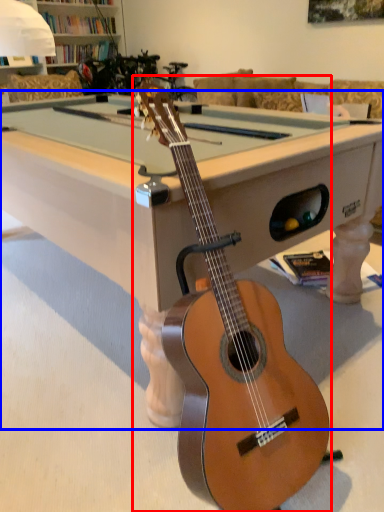
Question: Which of the following is the farthest to the observer, guitar (highlighted by a red box) or billiard table (highlighted by a blue box)?

Choices:
 (A) guitar
 (B) billiard table

Answer: (B)